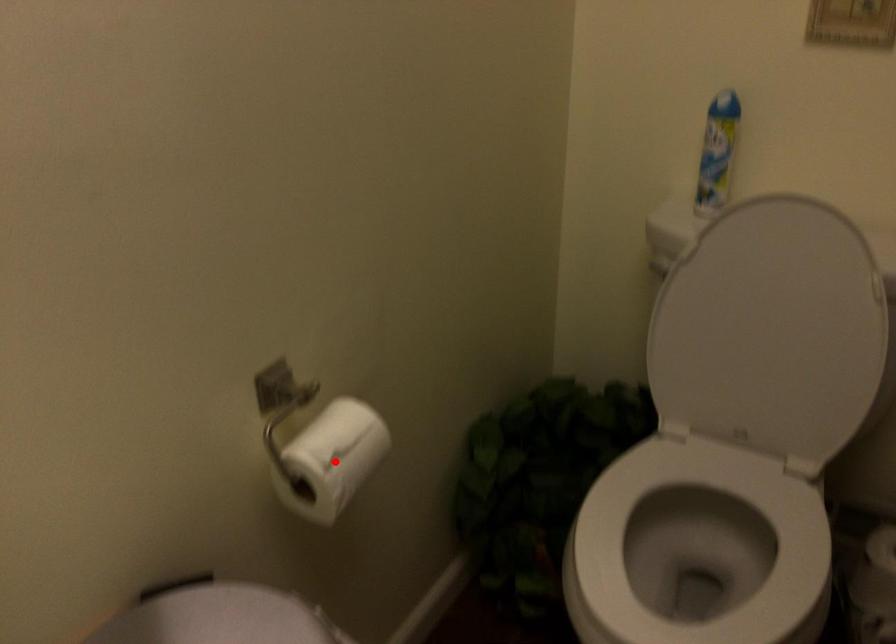
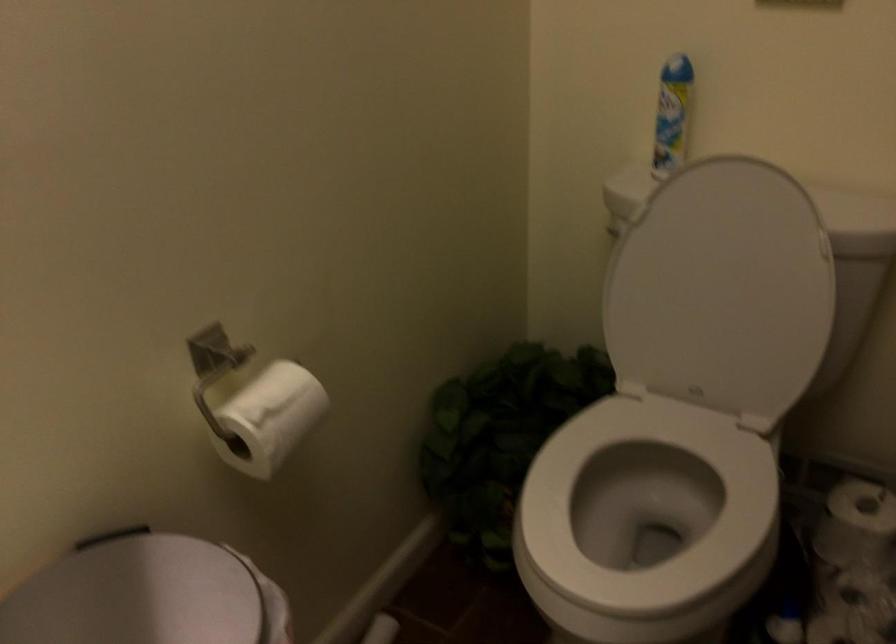
Find the pixel in the second image that matches the highlighted location in the first image.

(271, 417)